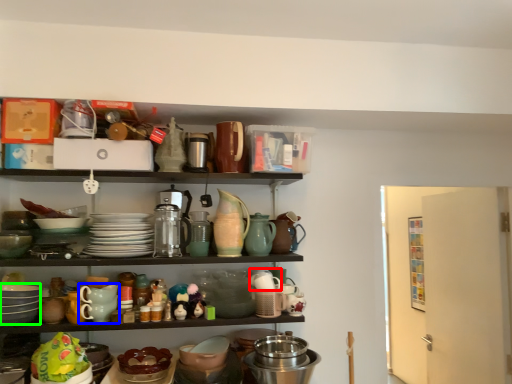
Question: Which is farther away from tableware (highlighted by a red box)? tableware (highlighted by a blue box) or tableware (highlighted by a green box)?

Choices:
 (A) tableware
 (B) tableware

Answer: (B)